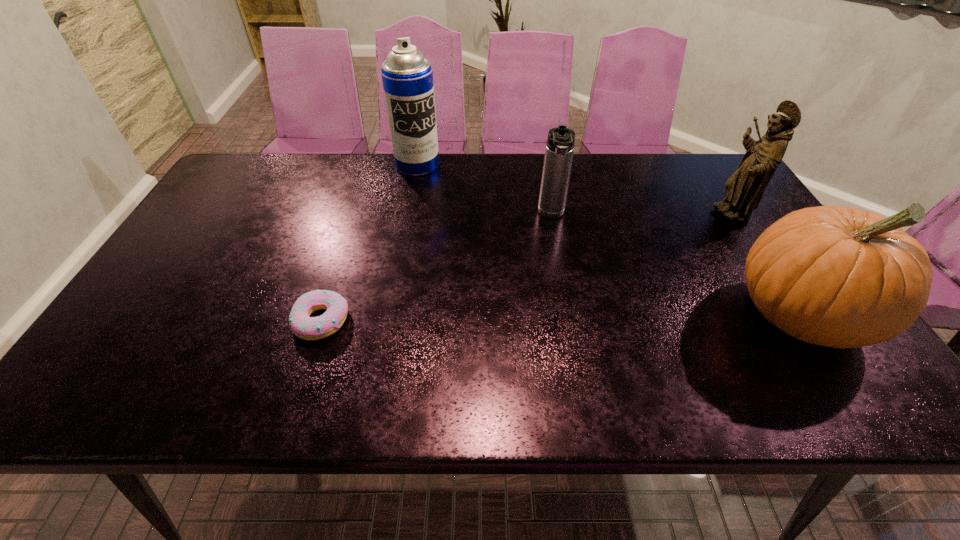
Where is `vacant region located 0.080m on the handle side of the second shortest object`? The image size is (960, 540). vacant region located 0.080m on the handle side of the second shortest object is located at coordinates (553, 247).

The image size is (960, 540). I want to click on vacant space located 0.190m on the handle side of the second shortest object, so click(x=554, y=277).

Locate an element on the screen. The width and height of the screenshot is (960, 540). vacant space located on the front-facing side of the figurine is located at coordinates (698, 236).

This screenshot has height=540, width=960. I want to click on free space located on the front-facing side of the figurine, so click(644, 268).

Image resolution: width=960 pixels, height=540 pixels. What are the coordinates of `free space located on the front-facing side of the figurine` in the screenshot? It's located at (707, 231).

This screenshot has height=540, width=960. I want to click on vacant space located on the label side of the fourth object from right to left, so click(x=431, y=190).

You are a GUI agent. You are given a task and a screenshot of the screen. Output one action in this format:
    pyautogui.click(x=<x>, y=<y>)
    Task: Click on the vacant space located 0.230m on the label side of the fourth object from right to left
    The height and width of the screenshot is (540, 960).
    Given the screenshot: What is the action you would take?
    pyautogui.click(x=445, y=218)

At what (x,y) coordinates should I click in order to perform the action: click on vacant space located 0.160m on the label side of the fourth object from right to left. Please return your answer as a coordinate pair (x, y). The height and width of the screenshot is (540, 960). Looking at the image, I should click on (439, 204).

Identify the location of object present at the far edge. (407, 76).

The height and width of the screenshot is (540, 960). I want to click on doughnut at the near edge, so click(308, 328).